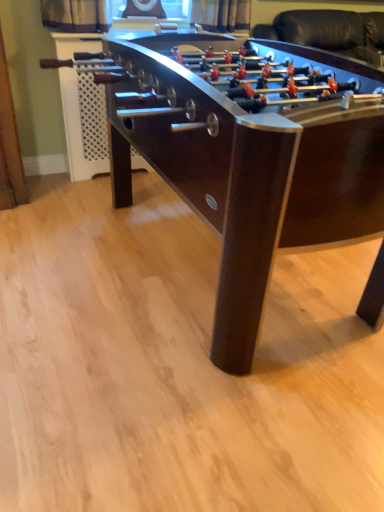
Locate an element on the screen. free spot below dark wood foosball table at center (from a real-world perspective) is located at coordinates (200, 269).